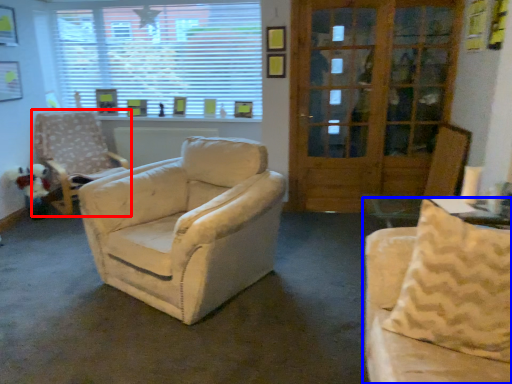
Question: Among these objects, which one is nearest to the camera, chair (highlighted by a red box) or studio couch (highlighted by a blue box)?

Choices:
 (A) chair
 (B) studio couch

Answer: (B)